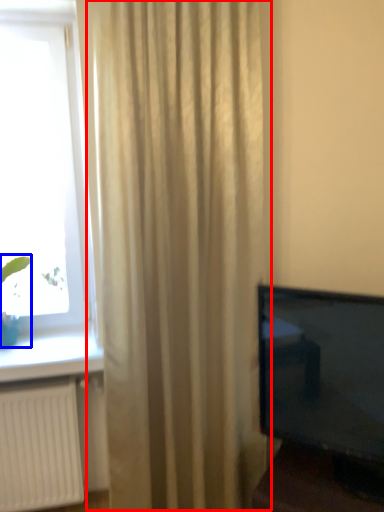
Question: Among these objects, which one is farthest to the camera, curtain (highlighted by a red box) or plant (highlighted by a blue box)?

Choices:
 (A) curtain
 (B) plant

Answer: (B)